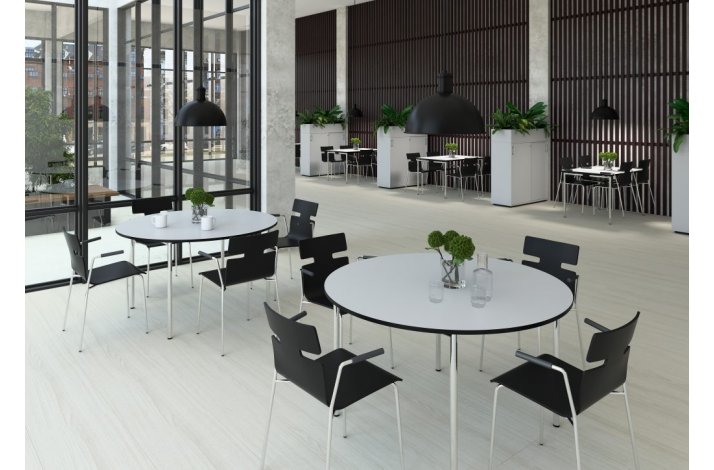
You are a GUI agent. You are given a task and a screenshot of the screen. Output one action in this format:
    pyautogui.click(x=<x>, y=<y>)
    Task: Click on the round tables with white tops
    The height and width of the screenshot is (470, 714).
    Given the screenshot: What is the action you would take?
    pyautogui.click(x=226, y=218), pyautogui.click(x=393, y=287), pyautogui.click(x=598, y=170), pyautogui.click(x=443, y=157), pyautogui.click(x=346, y=150)